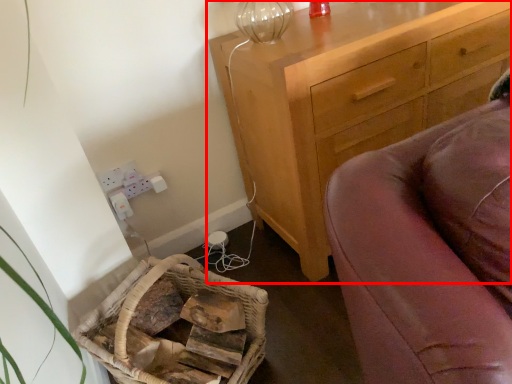
Question: From the image's perspective, where is chest of drawers (annotated by the red box) located in relation to basket in the image?

Choices:
 (A) above
 (B) below

Answer: (A)